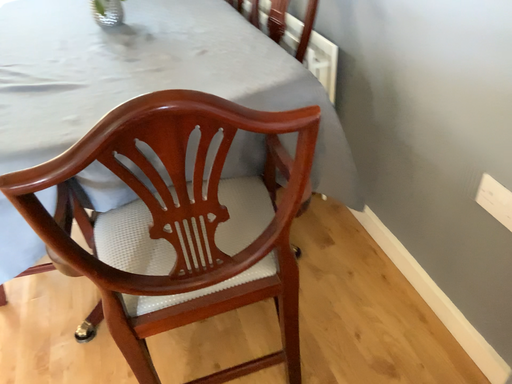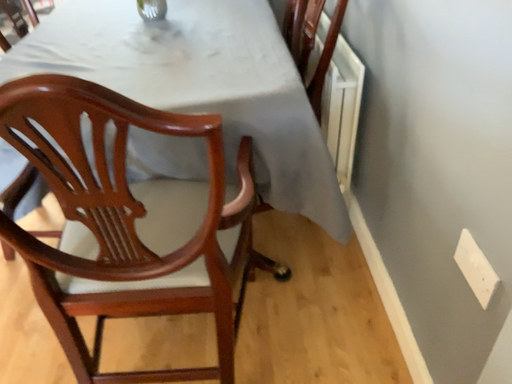
Question: Which way did the camera rotate in the video?

Choices:
 (A) rotated left
 (B) rotated right

Answer: (A)